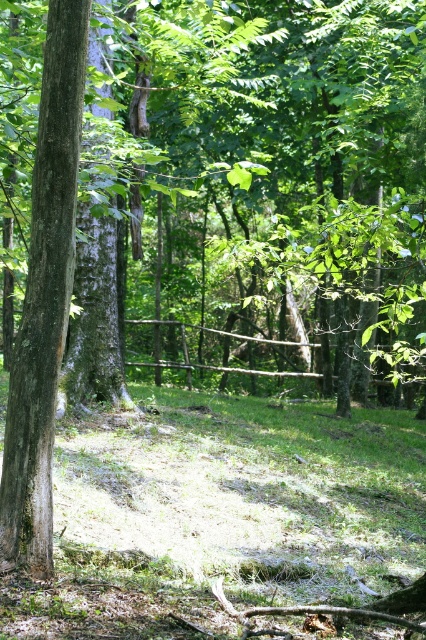
Can you confirm if smooth brown tree trunk at left is shorter than brown wooden fence at center?

No, smooth brown tree trunk at left is not shorter than brown wooden fence at center.

Can you confirm if smooth brown tree trunk at left is wider than brown wooden fence at center?

Correct, the width of smooth brown tree trunk at left exceeds that of brown wooden fence at center.

At what (x,y) coordinates should I click in order to perform the action: click on smooth brown tree trunk at left. Please return your answer as a coordinate pair (x, y). Looking at the image, I should click on (45, 298).

The height and width of the screenshot is (640, 426). In order to click on smooth brown tree trunk at left in this screenshot , I will do (45, 298).